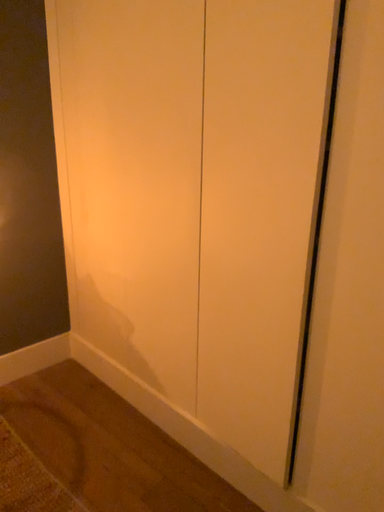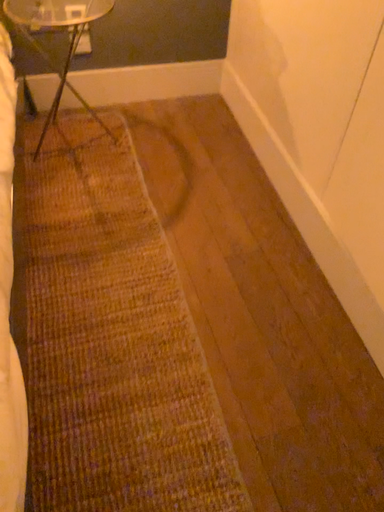
Question: Which way did the camera rotate in the video?

Choices:
 (A) rotated downward
 (B) rotated upward

Answer: (A)